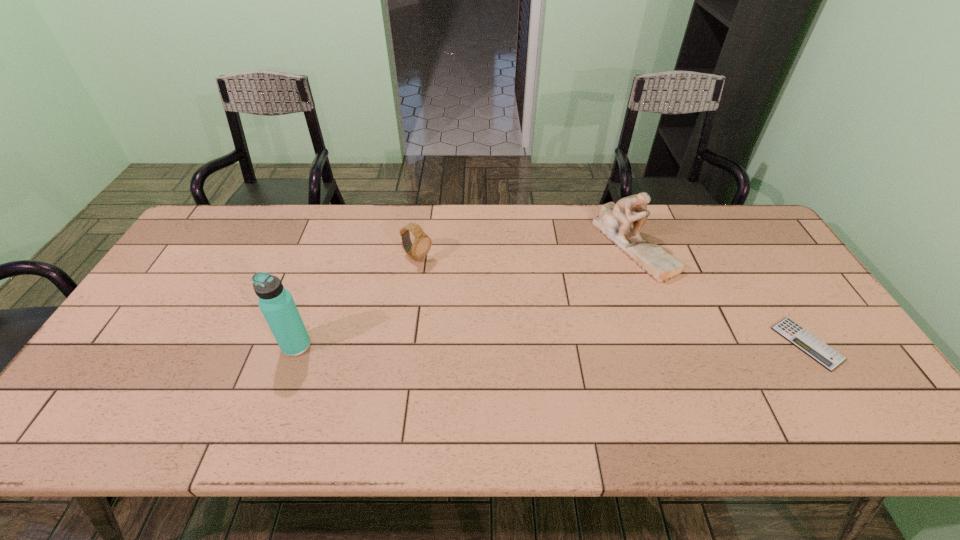
Where is `thermos bottle`? The width and height of the screenshot is (960, 540). thermos bottle is located at coordinates (276, 303).

Locate an element on the screen. the leftmost object is located at coordinates (276, 303).

The height and width of the screenshot is (540, 960). Find the location of `the shortest object`. the shortest object is located at coordinates (822, 353).

This screenshot has width=960, height=540. I want to click on the rightmost object, so click(822, 353).

Locate an element on the screen. Image resolution: width=960 pixels, height=540 pixels. the third object from right to left is located at coordinates (420, 248).

I want to click on the second shortest object, so click(x=420, y=248).

The width and height of the screenshot is (960, 540). I want to click on the third shortest object, so click(614, 220).

The width and height of the screenshot is (960, 540). Identify the location of the third object from left to right. (614, 220).

Where is `vacant space situated on the left of the thermos bottle`? Image resolution: width=960 pixels, height=540 pixels. vacant space situated on the left of the thermos bottle is located at coordinates (231, 346).

Where is `blank area located 0.110m on the back of the rightmost object`? This screenshot has height=540, width=960. blank area located 0.110m on the back of the rightmost object is located at coordinates (772, 288).